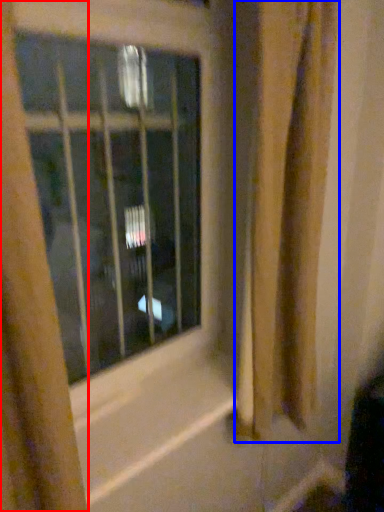
Question: Which object appears farthest to the camera in this image, curtain (highlighted by a red box) or shower curtain (highlighted by a blue box)?

Choices:
 (A) curtain
 (B) shower curtain

Answer: (B)